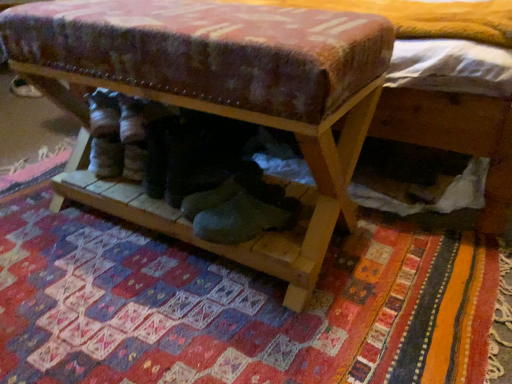
At what (x,y) coordinates should I click in order to perform the action: click on white suede shoe at lower left. Please return your answer as a coordinate pair (x, y). The height and width of the screenshot is (384, 512). Looking at the image, I should click on (23, 88).

The image size is (512, 384). What do you see at coordinates (23, 88) in the screenshot? I see `white suede shoe at lower left` at bounding box center [23, 88].

The height and width of the screenshot is (384, 512). I want to click on textured woolen mat at center, so click(237, 305).

From a real-world perspective, which object rests below the other?

white suede shoe at lower left.

In the scene shown: Considering the relative positions of white suede shoe at lower left and wooden shoe rack at center in the image provided, is white suede shoe at lower left to the right of wooden shoe rack at center from the viewer's perspective?

No.

Is white suede shoe at lower left behind wooden shoe rack at center?

Yes.

Could you tell me if white suede shoe at lower left is turned towards wooden shoe rack at center?

Yes, white suede shoe at lower left is facing wooden shoe rack at center.

Is textured woolen mat at center to the left of wooden shoe rack at center from the viewer's perspective?

No, textured woolen mat at center is not to the left of wooden shoe rack at center.

Is textured woolen mat at center located outside wooden shoe rack at center?

Absolutely, textured woolen mat at center is external to wooden shoe rack at center.

From a real-world perspective, between textured woolen mat at center and wooden shoe rack at center, who is vertically lower?

textured woolen mat at center is physically lower.

Based on their sizes in the image, would you say textured woolen mat at center is bigger or smaller than wooden shoe rack at center?

textured woolen mat at center is smaller than wooden shoe rack at center.

Does wooden shoe rack at center have a smaller size compared to textured woolen mat at center?

No.

Consider the image. How different are the orientations of wooden shoe rack at center and textured woolen mat at center in degrees?

There is a 0.276-degree angle between the facing directions of wooden shoe rack at center and textured woolen mat at center.

Considering the relative positions of wooden shoe rack at center and textured woolen mat at center in the image provided, is wooden shoe rack at center behind textured woolen mat at center?

Yes, wooden shoe rack at center is behind textured woolen mat at center.

Would you say textured woolen mat at center is outside white suede shoe at lower left?

textured woolen mat at center lies outside white suede shoe at lower left's area.

Which of these two, textured woolen mat at center or white suede shoe at lower left, is smaller?

white suede shoe at lower left is smaller.

How different are the orientations of textured woolen mat at center and white suede shoe at lower left in degrees?

There is a 54.9-degree angle between the facing directions of textured woolen mat at center and white suede shoe at lower left.

Which object is positioned more to the right, textured woolen mat at center or white suede shoe at lower left?

textured woolen mat at center is more to the right.

Relative to textured woolen mat at center, is white suede shoe at lower left in front or behind?

Clearly, white suede shoe at lower left is behind textured woolen mat at center.

Considering the relative sizes of white suede shoe at lower left and textured woolen mat at center in the image provided, is white suede shoe at lower left shorter than textured woolen mat at center?

No, white suede shoe at lower left is not shorter than textured woolen mat at center.

Is white suede shoe at lower left far away from textured woolen mat at center?

white suede shoe at lower left is far away from textured woolen mat at center.

Which of these two, wooden shoe rack at center or white suede shoe at lower left, stands shorter?

white suede shoe at lower left.

Considering the positions of objects wooden shoe rack at center and white suede shoe at lower left in the image provided, who is more to the right, wooden shoe rack at center or white suede shoe at lower left?

wooden shoe rack at center is more to the right.

Find the location of `furniture located above the white suede shoe at lower left (from a real-world perspective)`. furniture located above the white suede shoe at lower left (from a real-world perspective) is located at coordinates (217, 99).

Where is `shoe behind the wooden shoe rack at center`? The image size is (512, 384). shoe behind the wooden shoe rack at center is located at coordinates (23, 88).

You are a GUI agent. You are given a task and a screenshot of the screen. Output one action in this format:
    pyautogui.click(x=<x>, y=<y>)
    Task: Click on the furniture on the left of textured woolen mat at center
    This screenshot has height=384, width=512.
    Given the screenshot: What is the action you would take?
    pyautogui.click(x=217, y=99)

Which object lies nearer to the anchor point textured woolen mat at center, white suede shoe at lower left or wooden shoe rack at center?

The object closer to textured woolen mat at center is wooden shoe rack at center.

Estimate the real-world distances between objects in this image. Which object is further from white suede shoe at lower left, textured woolen mat at center or wooden shoe rack at center?

textured woolen mat at center.

Considering their positions, is wooden shoe rack at center positioned further to textured woolen mat at center than white suede shoe at lower left?

white suede shoe at lower left lies further to textured woolen mat at center than the other object.

Looking at the image, which one is located further to wooden shoe rack at center, white suede shoe at lower left or textured woolen mat at center?

white suede shoe at lower left lies further to wooden shoe rack at center than the other object.

Which object lies nearer to the anchor point white suede shoe at lower left, wooden shoe rack at center or textured woolen mat at center?

Among the two, wooden shoe rack at center is located nearer to white suede shoe at lower left.

From the image, which object appears to be farther from wooden shoe rack at center, textured woolen mat at center or white suede shoe at lower left?

white suede shoe at lower left.

The height and width of the screenshot is (384, 512). What are the coordinates of `furniture between textured woolen mat at center and white suede shoe at lower left from front to back` in the screenshot? It's located at (217, 99).